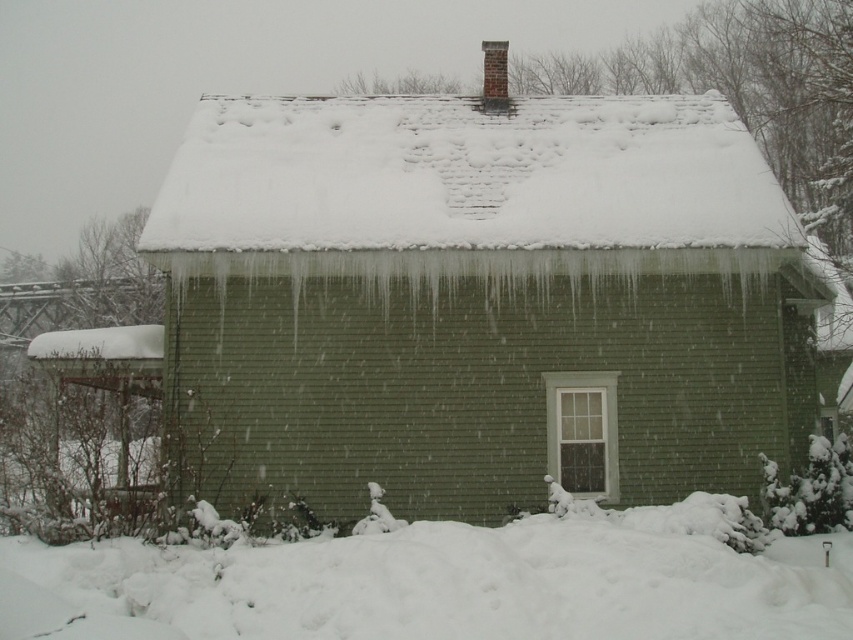
Question: Is white shingles at upper center behind white fluffy snow at lower center?

Choices:
 (A) no
 (B) yes

Answer: (B)

Question: Which of the following is the closest to the observer?

Choices:
 (A) (421, 216)
 (B) (595, 602)

Answer: (B)

Question: Is white shingles at upper center below white fluffy snow at lower center?

Choices:
 (A) yes
 (B) no

Answer: (B)

Question: Can you confirm if white shingles at upper center is positioned to the left of white fluffy snow at lower center?

Choices:
 (A) no
 (B) yes

Answer: (B)